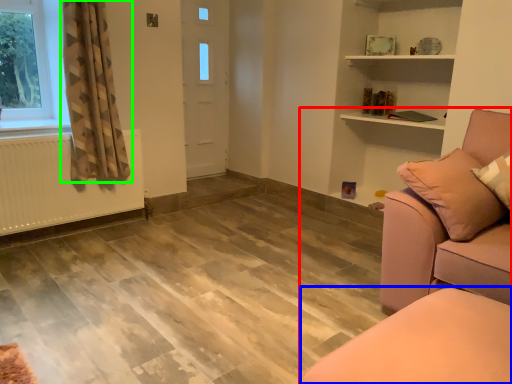
Question: Which object is positioned farthest from studio couch (highlighted by a red box)? Select from furniture (highlighted by a blue box) and curtain (highlighted by a green box).

Choices:
 (A) furniture
 (B) curtain

Answer: (B)